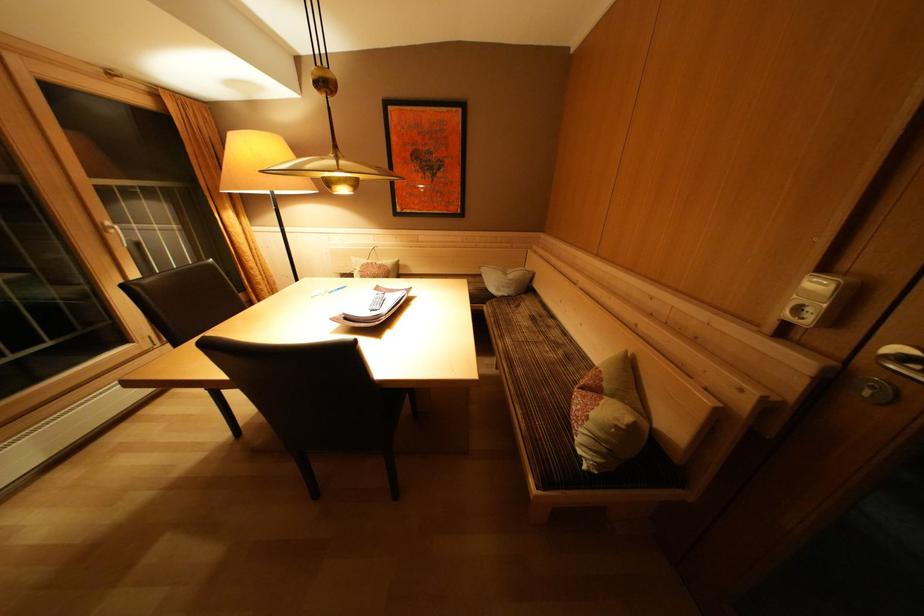
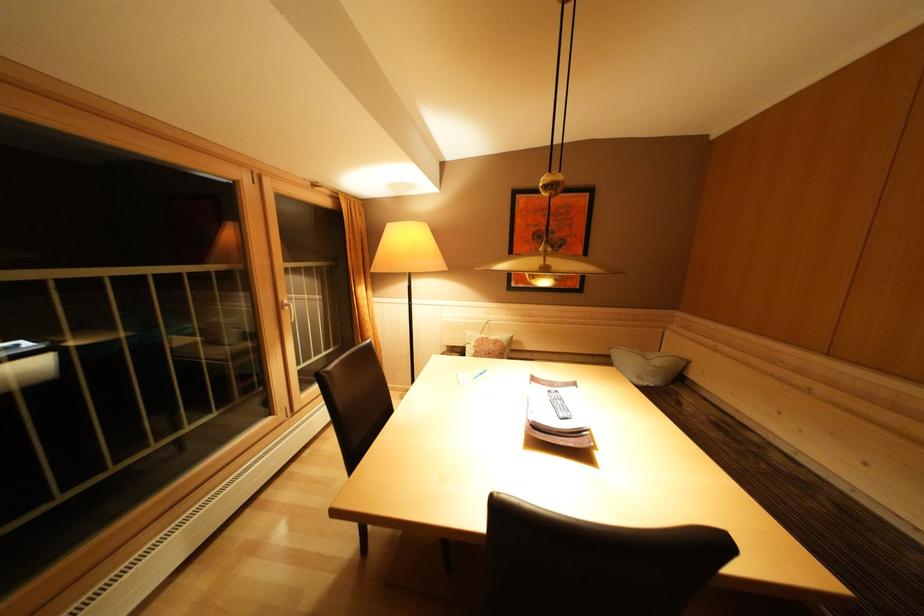
Question: The images are taken continuously from a first-person perspective. In which direction is your viewpoint rotating?

Choices:
 (A) Left
 (B) Right
 (C) Up
 (D) Down

Answer: (C)